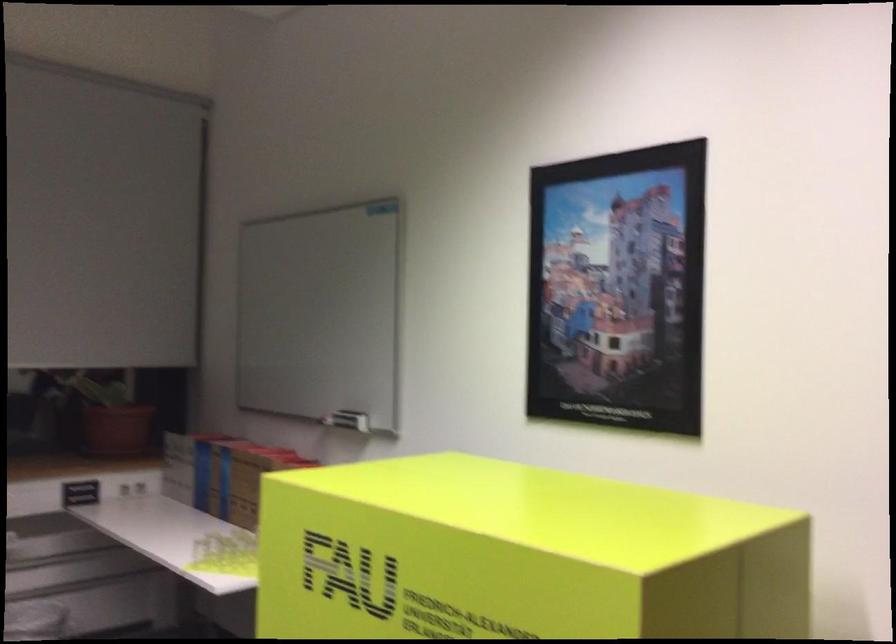
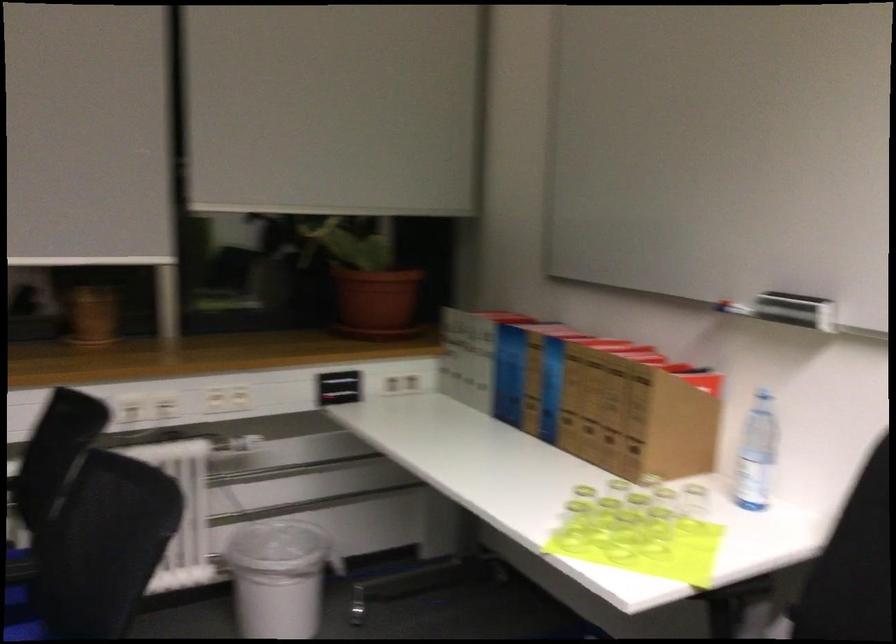
The point at [83,493] is marked in the first image. Where is the corresponding point in the second image?

(339, 386)